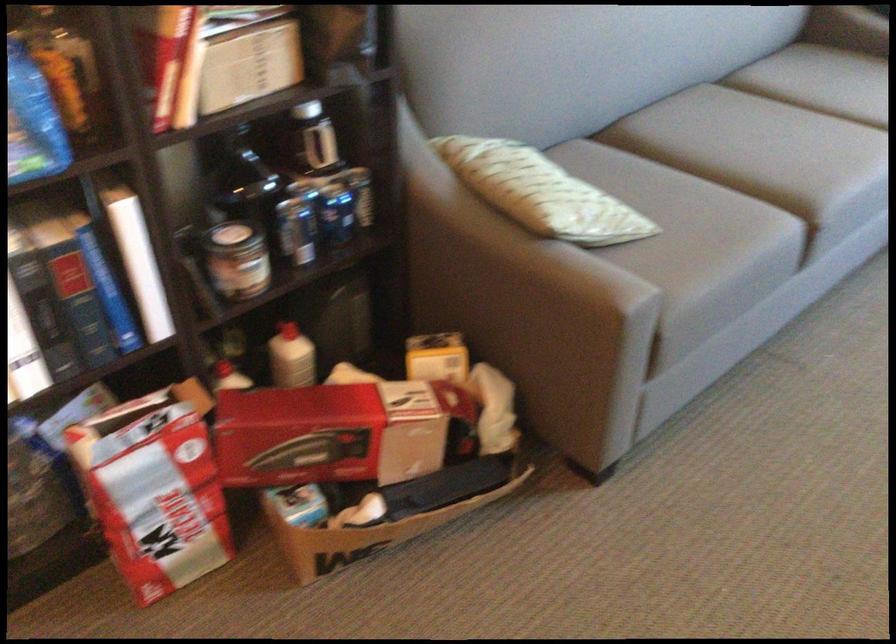
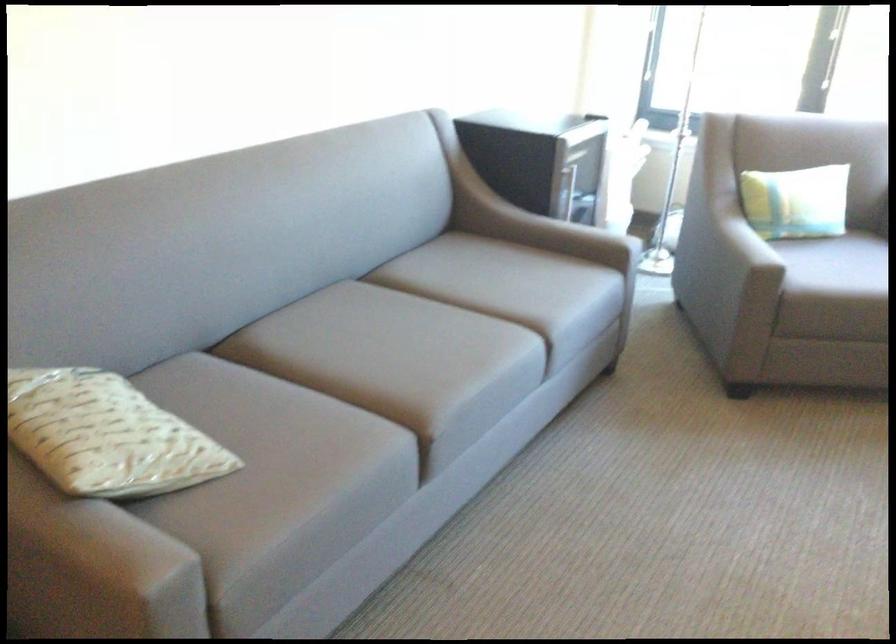
Question: Which direction would the cameraman need to move to produce the second image? Reply with the corresponding letter.

Choices:
 (A) Left
 (B) Right
 (C) Forward
 (D) Backward

Answer: (B)